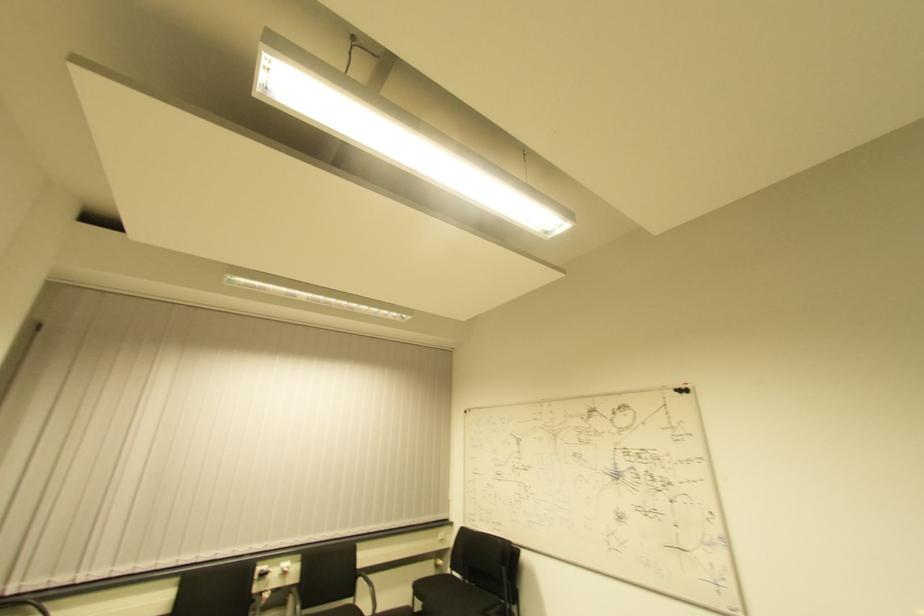
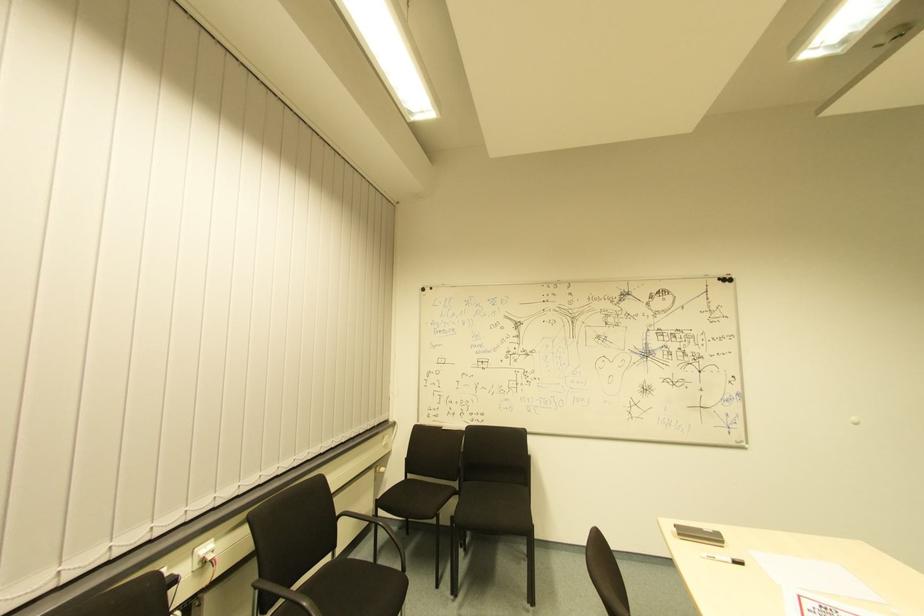
Where in the second image is the point corresponding to pixel 284 572 from the first image?

(208, 561)